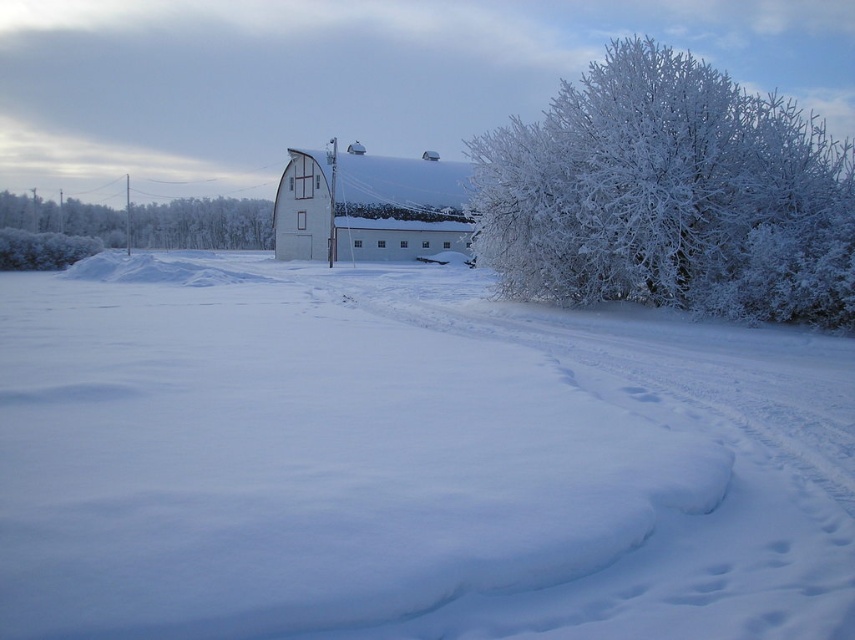
From the picture: You are standing in the winter landscape and want to take a closer look at the frosted white bush at right and the white matte barn at center. Which object will you reach first as you move forward?

You will reach the frosted white bush at right first because it is closer to the viewer than the white matte barn at center.

You are an artist planning to paint this winter scene. You want to ensure the frosted white bush at right and the white matte barn at center are proportionally accurate. Which object should you draw first to maintain proper scale, and why?

You should draw the frosted white bush at right first because it is much taller than the white matte barn at center, so starting with the larger object ensures the scale of the white matte barn at center can be adjusted accordingly.